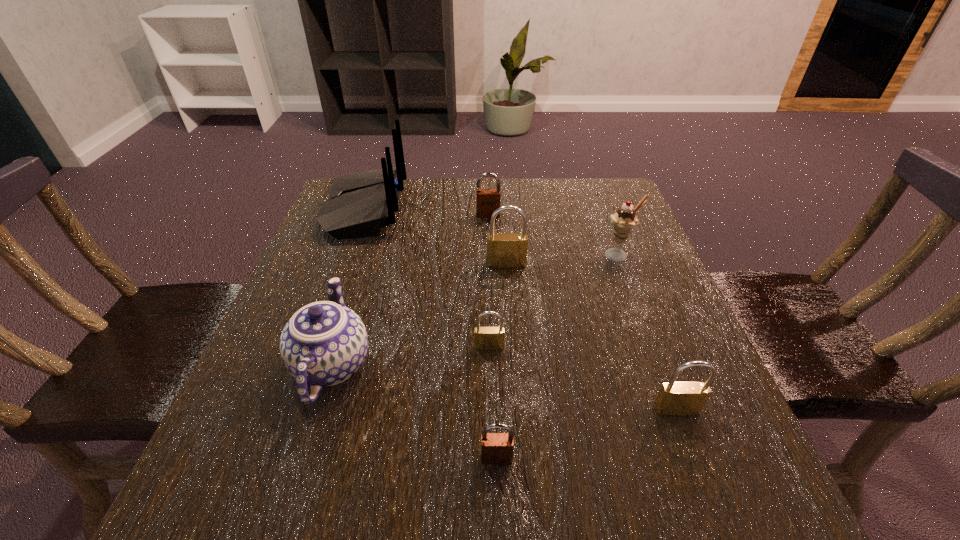
At what (x,y) coordinates should I click in order to perform the action: click on free space between the tallest padlock and the nearer brown padlock. Please return your answer as a coordinate pair (x, y). This screenshot has width=960, height=540. Looking at the image, I should click on (501, 361).

I want to click on vacant point located between the router and the smaller brown padlock, so click(x=431, y=334).

The height and width of the screenshot is (540, 960). In order to click on free spot between the nearest object and the biggest brass padlock in this screenshot , I will do `click(501, 361)`.

Where is `free space between the chinaware and the nearest brass padlock`? The width and height of the screenshot is (960, 540). free space between the chinaware and the nearest brass padlock is located at coordinates (504, 387).

Where is `unoccupied position between the nearest object and the black router`? unoccupied position between the nearest object and the black router is located at coordinates (431, 334).

The width and height of the screenshot is (960, 540). I want to click on free space between the fourth farthest padlock and the icecream, so click(x=648, y=333).

Locate which object ranks fifth in proximity to the second nearest brass padlock. Please provide its 2D coordinates. Your answer should be formatted as a tuple, i.e. [(x, y)], where the tuple contains the x and y coordinates of a point satisfying the conditions above.

[(624, 220)]

Select which object is the second closest to the biggest brass padlock. Please provide its 2D coordinates. Your answer should be formatted as a tuple, i.e. [(x, y)], where the tuple contains the x and y coordinates of a point satisfying the conditions above.

[(624, 220)]

Choose which padlock is the third nearest neighbor to the bigger brown padlock. Please provide its 2D coordinates. Your answer should be formatted as a tuple, i.e. [(x, y)], where the tuple contains the x and y coordinates of a point satisfying the conditions above.

[(675, 398)]

Locate an element on the screen. The height and width of the screenshot is (540, 960). padlock object that ranks as the fifth closest to the tallest object is located at coordinates (675, 398).